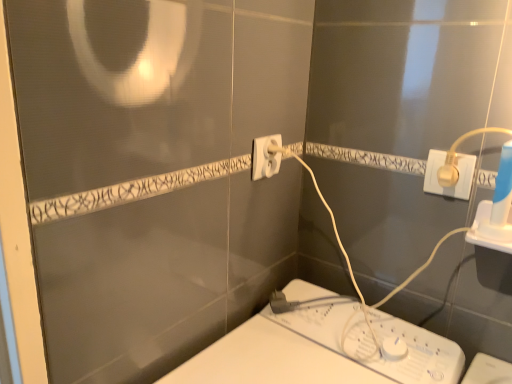
Question: In terms of height, does white plastic plug at upper right, which is the 1th power plugs and sockets in right-to-left order, look taller or shorter compared to white plastic plug at center, which ranks as the second power plugs and sockets in front-to-back order?

Choices:
 (A) tall
 (B) short

Answer: (B)

Question: In the image, is white plastic plug at upper right, acting as the second power plugs and sockets starting from the back, on the left side or the right side of white plastic plug at center, the second power plugs and sockets when ordered from right to left?

Choices:
 (A) right
 (B) left

Answer: (A)

Question: From a real-world perspective, is white plastic plug at upper right, which is the 1th power plugs and sockets in right-to-left order, positioned above or below white plastic plug at center, the first power plugs and sockets from the back?

Choices:
 (A) below
 (B) above

Answer: (A)

Question: Is white plastic plug at center, which ranks as the second power plugs and sockets in front-to-back order, in front of or behind white plastic plug at upper right, which is the 1th power plugs and sockets in right-to-left order, in the image?

Choices:
 (A) behind
 (B) front

Answer: (A)

Question: In terms of size, does white plastic plug at center, the second power plugs and sockets when ordered from right to left, appear bigger or smaller than white plastic plug at upper right, which is the first power plugs and sockets from front to back?

Choices:
 (A) big
 (B) small

Answer: (A)

Question: Is white plastic plug at center, which ranks as the second power plugs and sockets in front-to-back order, inside the boundaries of white plastic plug at upper right, positioned as the 2th power plugs and sockets in left-to-right order, or outside?

Choices:
 (A) inside
 (B) outside

Answer: (B)

Question: In terms of height, does white plastic plug at center, which is counted as the 1th power plugs and sockets, starting from the left, look taller or shorter compared to white plastic plug at upper right, which is the 1th power plugs and sockets in right-to-left order?

Choices:
 (A) short
 (B) tall

Answer: (B)